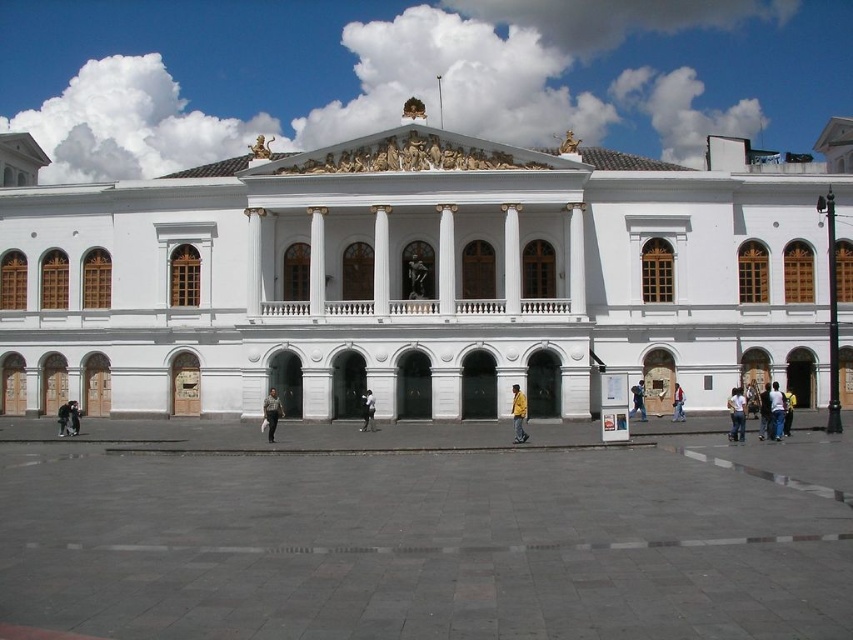
Question: Estimate the real-world distances between objects in this image. Which object is closer to the dark gray jacket at lower left?

Choices:
 (A) black leather jacket at lower left
 (B) denim jacket at center
 (C) denim jacket at lower right

Answer: (A)

Question: Does light blue jeans at center have a lesser width compared to dark blue jeans at center?

Choices:
 (A) yes
 (B) no

Answer: (B)

Question: Which point appears farthest from the camera in this image?

Choices:
 (A) (61, 417)
 (B) (643, 404)

Answer: (B)

Question: Does light blue jeans at lower right have a greater width compared to denim jacket at center?

Choices:
 (A) no
 (B) yes

Answer: (B)

Question: Which of these objects is positioned closest to the light brown leather jacket at center?

Choices:
 (A) white leather jacket at center
 (B) denim jacket at lower right

Answer: (A)

Question: Is light blue jeans at lower right to the left of white leather jacket at center from the viewer's perspective?

Choices:
 (A) yes
 (B) no

Answer: (B)